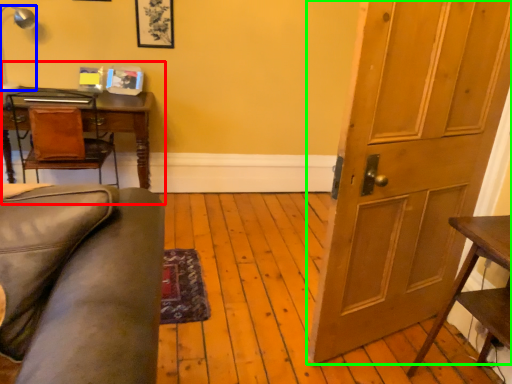
Question: Estimate the real-world distances between objects in this image. Which object is closer to computer desk (highlighted by a red box), lamp (highlighted by a blue box) or door (highlighted by a green box)?

Choices:
 (A) lamp
 (B) door

Answer: (A)